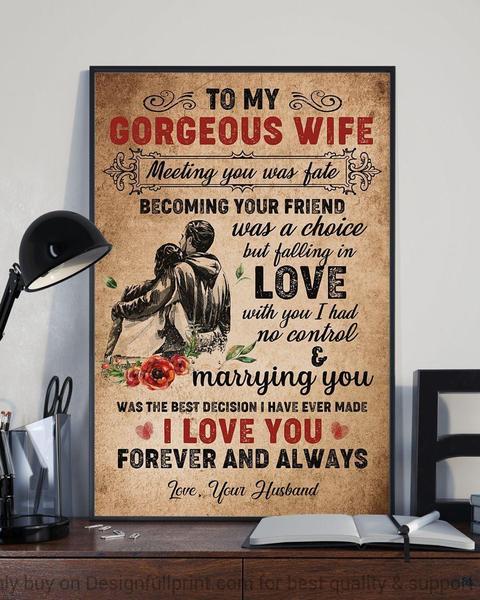
Where is `pens`? This screenshot has height=600, width=480. pens is located at coordinates (415, 524).